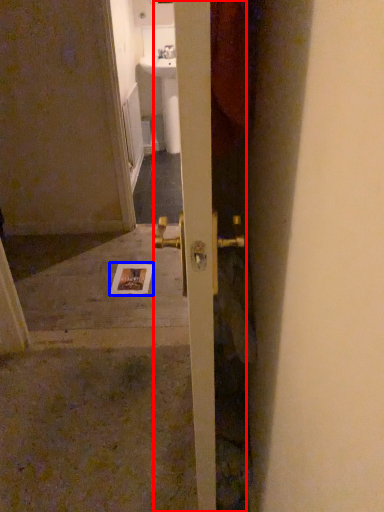
Question: Which object appears farthest to the camera in this image, door (highlighted by a red box) or postcard (highlighted by a blue box)?

Choices:
 (A) door
 (B) postcard

Answer: (B)